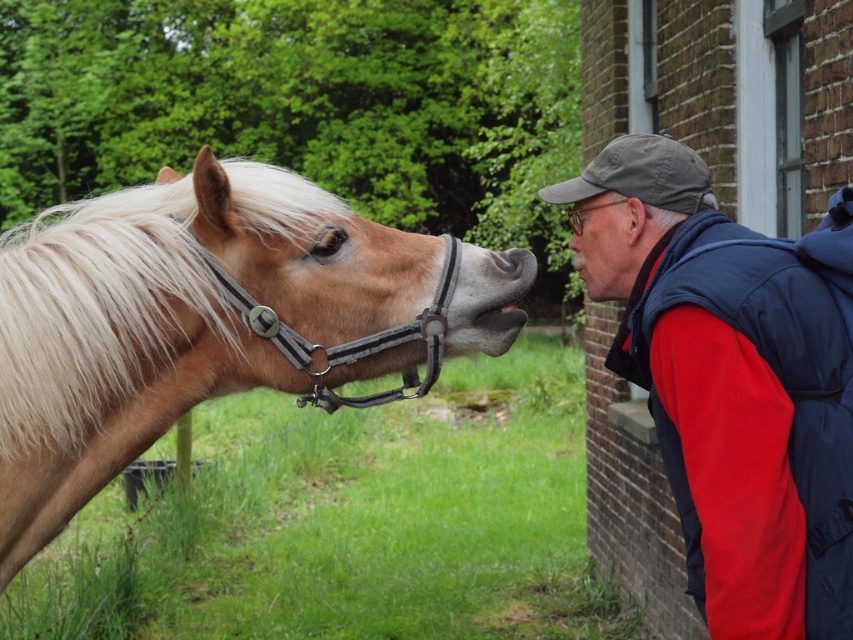
Question: Which point is closer to the camera?

Choices:
 (A) light brown leather bridle at center
 (B) matte skin nose at center
 (C) blonde mane and bridle at left

Answer: (C)

Question: Which is nearer to the blonde mane and bridle at left?

Choices:
 (A) light brown leather bridle at center
 (B) blonde silky mane at left
 (C) blue fleece vest at right

Answer: (B)

Question: Can you confirm if blonde silky mane at left is positioned to the left of matte skin nose at center?

Choices:
 (A) no
 (B) yes

Answer: (B)

Question: Which point is closer to the camera?

Choices:
 (A) matte skin nose at center
 (B) light brown leather bridle at center
 (C) blonde mane and bridle at left

Answer: (C)

Question: Is blonde mane and bridle at left thinner than blue fleece vest at right?

Choices:
 (A) yes
 (B) no

Answer: (B)

Question: Is blonde silky mane at left above matte skin nose at center?

Choices:
 (A) yes
 (B) no

Answer: (B)